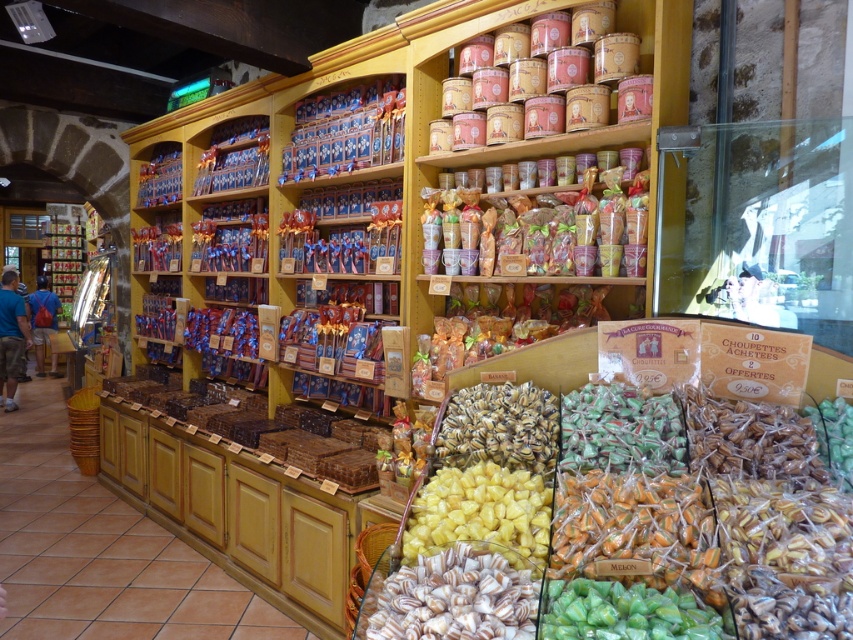
Between yellow sugary candy at center and green glossy candy at center, which one appears on the right side from the viewer's perspective?

Positioned to the right is green glossy candy at center.

Who is positioned more to the left, yellow sugary candy at center or green glossy candy at center?

From the viewer's perspective, yellow sugary candy at center appears more on the left side.

Does point (466, 528) come farther from viewer compared to point (596, 621)?

Yes, it is.

You are a GUI agent. You are given a task and a screenshot of the screen. Output one action in this format:
    pyautogui.click(x=<x>, y=<y>)
    Task: Click on the yellow sugary candy at center
    
    Given the screenshot: What is the action you would take?
    pyautogui.click(x=480, y=512)

Does white glossy candy at center appear on the right side of green glossy candy at center?

No, white glossy candy at center is not to the right of green glossy candy at center.

Measure the distance between white glossy candy at center and camera.

The distance of white glossy candy at center from camera is 4.77 feet.

Between point (532, 611) and point (596, 611), which one is positioned in front?

Point (596, 611)

Identify the location of white glossy candy at center. This screenshot has height=640, width=853. (451, 598).

Between white glossy candy at center and brown matte candy at center, which one has more height?

Standing taller between the two is brown matte candy at center.

Is white glossy candy at center thinner than brown matte candy at center?

No.

Is point (451, 608) more distant than point (550, 394)?

No, (451, 608) is in front of (550, 394).

At what (x,y) coordinates should I click in order to perform the action: click on white glossy candy at center. Please return your answer as a coordinate pair (x, y). The image size is (853, 640). Looking at the image, I should click on (451, 598).